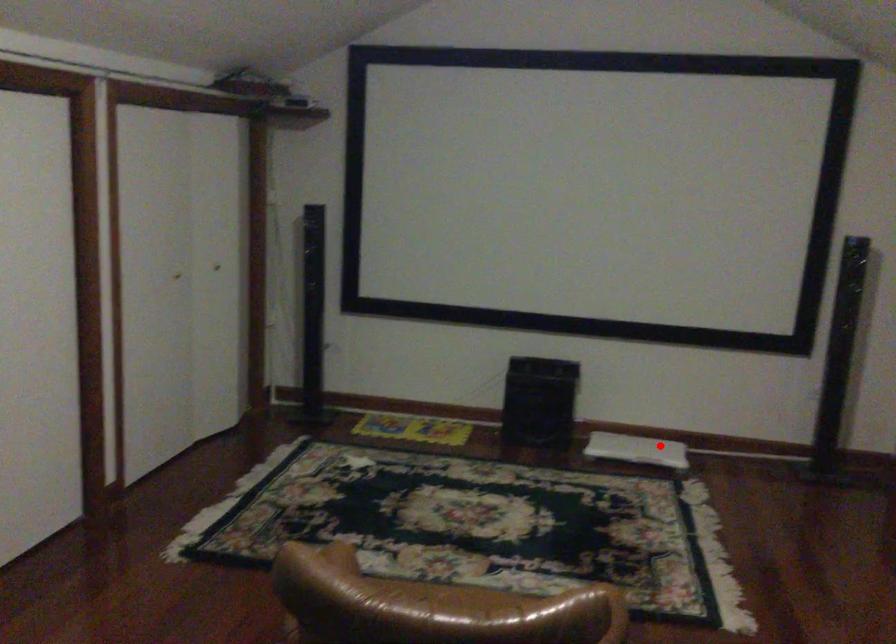
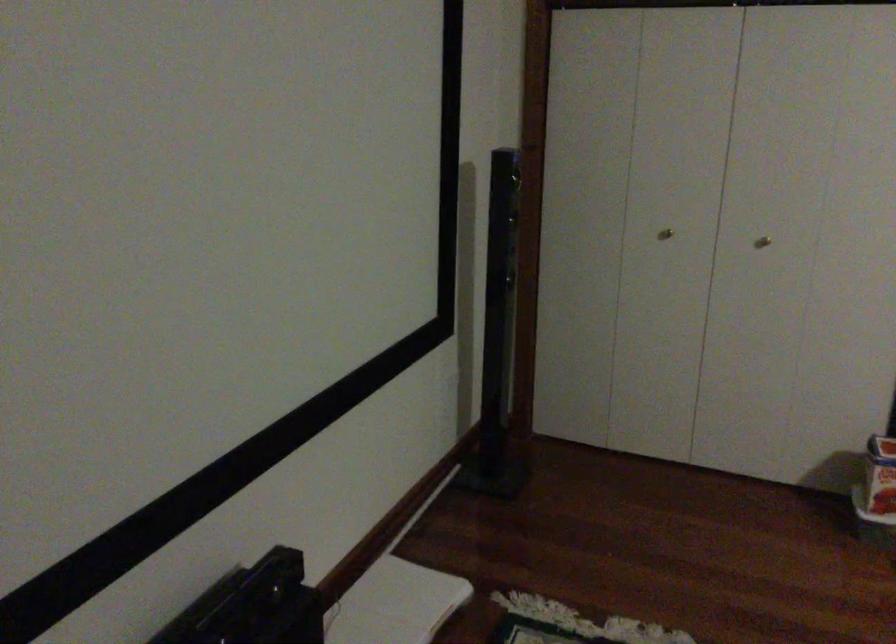
Question: I am providing you with two images of the same scene from different viewpoints. A red point is shown in image1. For the corresponding object point in image2, is it positioned nearer or farther from the camera?

Choices:
 (A) Nearer
 (B) Farther

Answer: (A)